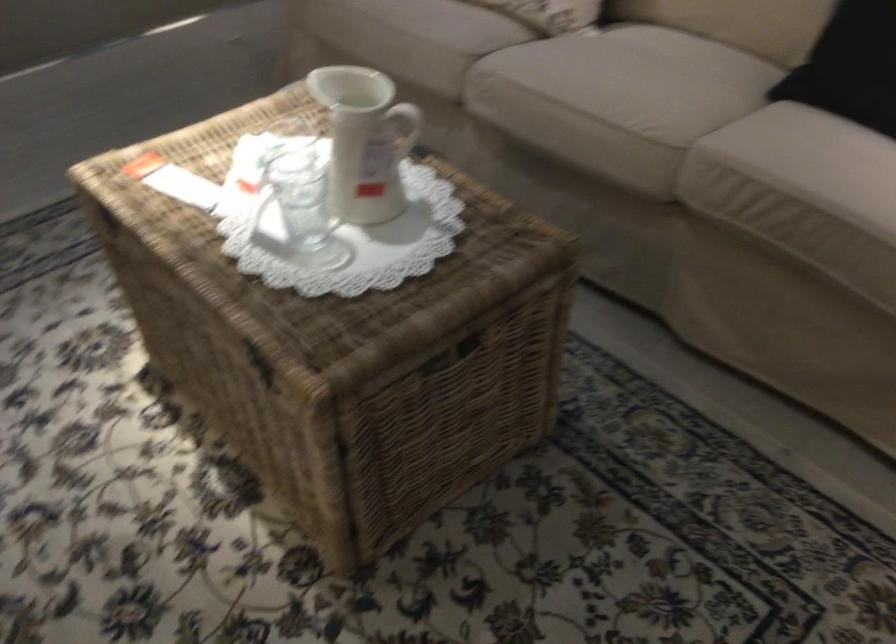
This screenshot has height=644, width=896. I want to click on white pitcher handle, so click(365, 140).